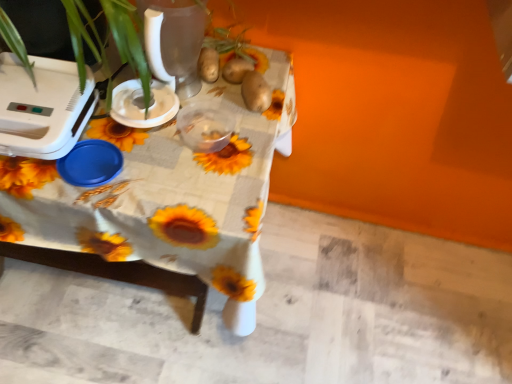
Question: Does white plastic blender at upper left, arranged as the 2th appliance when viewed from the left, lie behind white plastic appliance at left, the 2th appliance when ordered from right to left?

Choices:
 (A) yes
 (B) no

Answer: (A)

Question: Does white plastic blender at upper left, which appears as the first appliance when viewed from the right, have a greater height compared to white plastic appliance at left, the first appliance from the left?

Choices:
 (A) no
 (B) yes

Answer: (A)

Question: From the image's perspective, is white plastic blender at upper left, arranged as the 2th appliance when viewed from the left, above white plastic appliance at left, the first appliance from the left?

Choices:
 (A) no
 (B) yes

Answer: (B)

Question: Is white plastic blender at upper left, arranged as the 2th appliance when viewed from the left, closer to camera compared to white plastic appliance at left, the first appliance from the left?

Choices:
 (A) yes
 (B) no

Answer: (B)

Question: Can you confirm if white plastic blender at upper left, arranged as the 2th appliance when viewed from the left, is positioned to the left of white plastic appliance at left, the 2th appliance when ordered from right to left?

Choices:
 (A) yes
 (B) no

Answer: (B)

Question: Does white plastic blender at upper left, arranged as the 2th appliance when viewed from the left, contain white plastic appliance at left, the 2th appliance when ordered from right to left?

Choices:
 (A) yes
 (B) no

Answer: (B)

Question: Does brown matte potato at upper center, which ranks as the first potato in left-to-right order, appear on the right side of white plastic appliance at left, the first appliance from the left?

Choices:
 (A) no
 (B) yes

Answer: (B)

Question: Is the depth of brown matte potato at upper center, which appears as the second potato when viewed from the right, greater than that of white plastic appliance at left, the 2th appliance when ordered from right to left?

Choices:
 (A) yes
 (B) no

Answer: (A)

Question: Does brown matte potato at upper center, which ranks as the first potato in left-to-right order, contain white plastic appliance at left, the 2th appliance when ordered from right to left?

Choices:
 (A) yes
 (B) no

Answer: (B)

Question: Are brown matte potato at upper center, which appears as the second potato when viewed from the right, and white plastic appliance at left, the 2th appliance when ordered from right to left, located far from each other?

Choices:
 (A) yes
 (B) no

Answer: (B)

Question: Is brown matte potato at upper center, which appears as the second potato when viewed from the right, oriented towards white plastic appliance at left, the 2th appliance when ordered from right to left?

Choices:
 (A) yes
 (B) no

Answer: (B)

Question: From a real-world perspective, is brown matte potato at upper center, which ranks as the first potato in left-to-right order, over white plastic appliance at left, the first appliance from the left?

Choices:
 (A) no
 (B) yes

Answer: (A)

Question: Is sunflower-patterned fabric at center further to the viewer compared to brown matte potato at upper center, which appears as the second potato when viewed from the right?

Choices:
 (A) yes
 (B) no

Answer: (B)